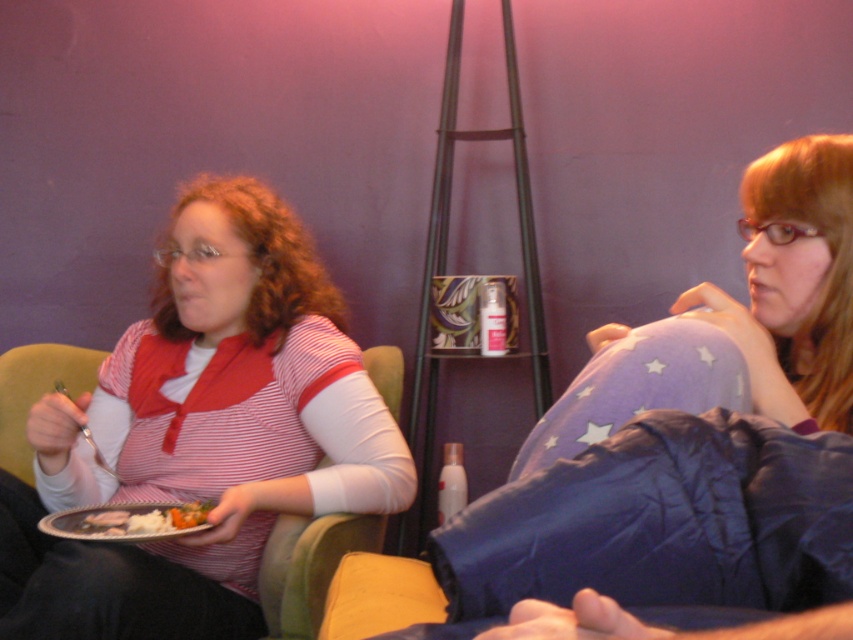
Can you confirm if matte striped shirt at left is bigger than white matte plate at lower left?

Correct, matte striped shirt at left is larger in size than white matte plate at lower left.

Is matte striped shirt at left wider than white matte plate at lower left?

Yes.

Which is in front, point (256, 364) or point (105, 516)?

Point (105, 516) is more forward.

Locate an element on the screen. The image size is (853, 640). matte striped shirt at left is located at coordinates pyautogui.click(x=202, y=433).